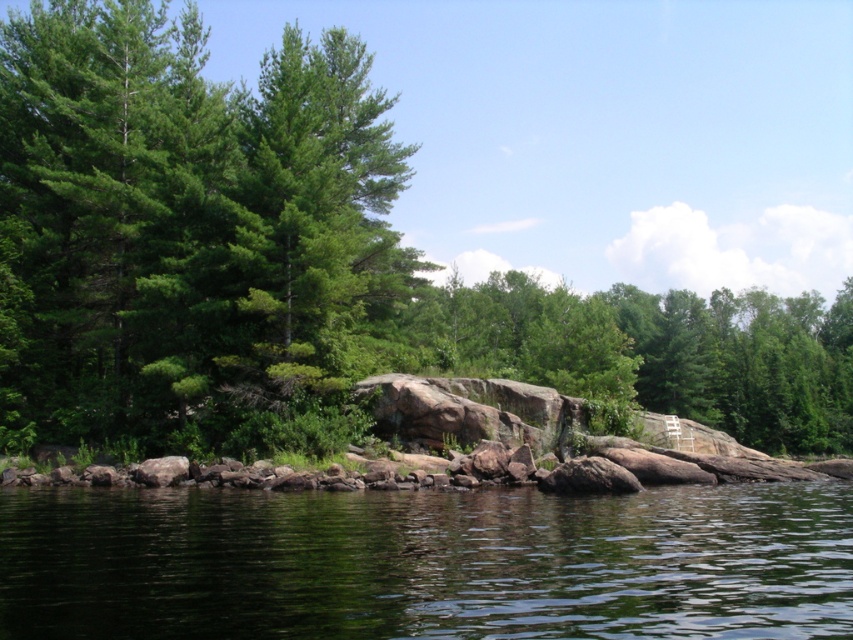
Question: Is transparent water at lower center bigger than green matte tree at center?

Choices:
 (A) no
 (B) yes

Answer: (A)

Question: Which point is closer to the camera?

Choices:
 (A) green matte tree at left
 (B) green matte tree at center
 (C) transparent water at lower center

Answer: (C)

Question: Which point is farther from the camera taking this photo?

Choices:
 (A) (288, 444)
 (B) (193, 541)

Answer: (A)

Question: Which object is closer to the camera taking this photo?

Choices:
 (A) green matte tree at center
 (B) green matte tree at left
 (C) transparent water at lower center

Answer: (C)

Question: Is the position of transparent water at lower center less distant than that of green matte tree at center?

Choices:
 (A) yes
 (B) no

Answer: (A)

Question: Does green matte tree at left lie in front of green matte tree at center?

Choices:
 (A) yes
 (B) no

Answer: (A)